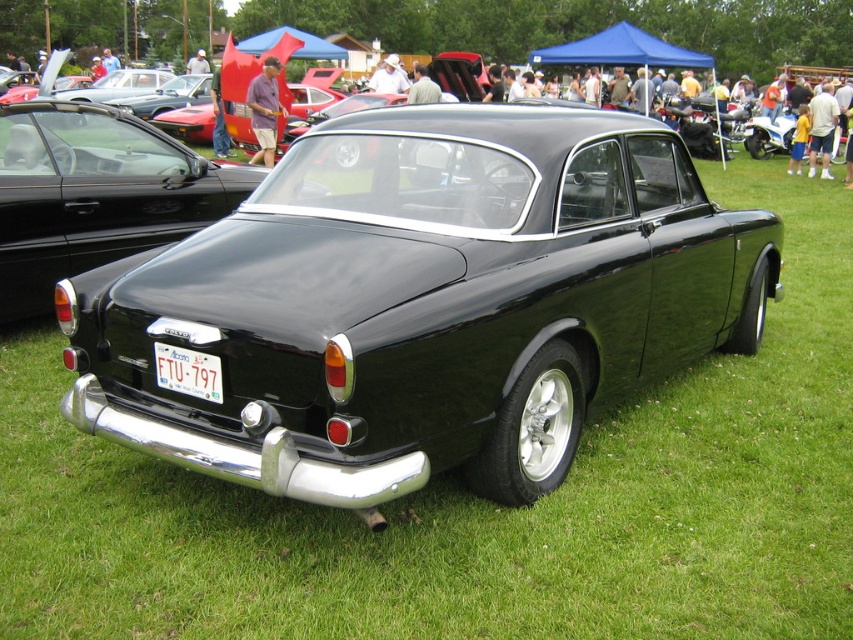
From the picture: You are a photographer at the car show and need to capture both the black glossy car at center and the white plastic license plate at center in a single shot. Since the license plate is smaller, will you need to adjust your camera angle to ensure both are clearly visible?

The black glossy car at center is larger in size than the white plastic license plate at center. To capture both clearly in one shot, you might need to adjust your camera angle to ensure the license plate isn

You are standing at the edge of the grassy field where the black glossy car at center is parked. You want to take a photo of the car without any other vehicles in the frame. Considering the distance between you and the car, can you step back further to ensure the other cars in the background are out of the shot?

The black glossy car at center is 5.28 meters from viewer. Since you are already 5.28 meters away, stepping back further would increase the distance, potentially allowing you to frame the car without the other vehicles visible in the background.

You are a photographer trying to capture the black glossy car at center and the white plastic license plate at center in a single frame. Based on their sizes, which object would appear larger in the photo?

The black glossy car at center would appear larger in the photo because its width is larger than the white plastic license plate at center.